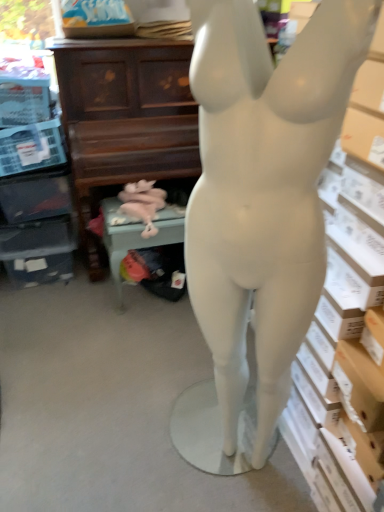
Locate an element on the screen. The height and width of the screenshot is (512, 384). free space above pink fabric stuffed animal at lower center (from a real-world perspective) is located at coordinates (142, 205).